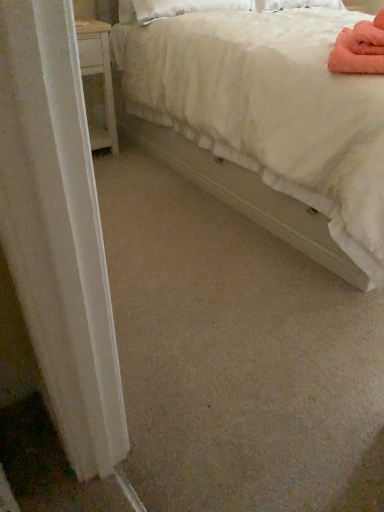
Question: Is pink fluffy bath towel at upper right taller or shorter than white fluffy bed at upper right?

Choices:
 (A) tall
 (B) short

Answer: (B)

Question: Would you say pink fluffy bath towel at upper right is to the left or to the right of white fluffy bed at upper right in the picture?

Choices:
 (A) left
 (B) right

Answer: (A)

Question: Is pink fluffy bath towel at upper right in front of or behind white fluffy bed at upper right in the image?

Choices:
 (A) front
 (B) behind

Answer: (B)

Question: From the image's perspective, relative to pink fluffy bath towel at upper right, is white fluffy bed at upper right above or below?

Choices:
 (A) below
 (B) above

Answer: (B)

Question: In terms of width, does white fluffy bed at upper right look wider or thinner when compared to pink fluffy bath towel at upper right?

Choices:
 (A) wide
 (B) thin

Answer: (A)

Question: Is point (165, 140) closer or farther from the camera than point (349, 31)?

Choices:
 (A) farther
 (B) closer

Answer: (A)

Question: From a real-world perspective, relative to pink fluffy bath towel at upper right, is white fluffy bed at upper right vertically above or below?

Choices:
 (A) above
 (B) below

Answer: (B)